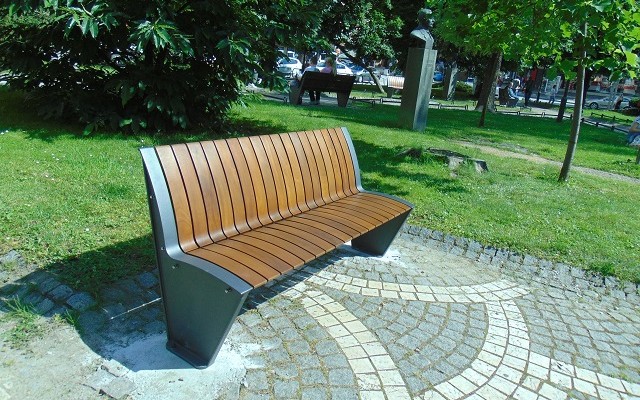
Identify the location of wooden seat. (248, 271).